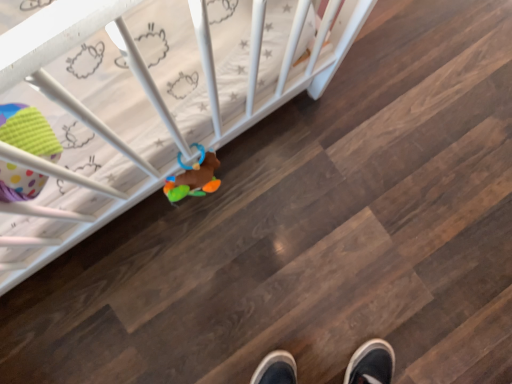
In order to face white plastic crib at upper left, should I rotate leftwards or rightwards?

Rotate your view right by about 3.658°.

What are the coordinates of `multicolored plush toy at center, the 1th toy when ordered from back to front` in the screenshot? It's located at (193, 177).

What are the coordinates of `polka dot fabric toy at left, which is counted as the first toy, starting from the front` in the screenshot? It's located at (28, 131).

Is point (36, 201) in front of point (8, 140)?

No.

Is white plastic crib at upper left facing towards polka dot fabric toy at left, which is counted as the first toy, starting from the front?

No, white plastic crib at upper left does not turn towards polka dot fabric toy at left, which is counted as the first toy, starting from the front.

Is white plastic crib at upper left directly adjacent to polka dot fabric toy at left, which is counted as the first toy, starting from the front?

No, white plastic crib at upper left is not making contact with polka dot fabric toy at left, which is counted as the first toy, starting from the front.

From their relative heights in the image, would you say polka dot fabric toy at left, marked as the first toy in a left-to-right arrangement, is taller or shorter than white plastic crib at upper left?

In the image, polka dot fabric toy at left, marked as the first toy in a left-to-right arrangement, appears to be taller than white plastic crib at upper left.

Where is `infant bed above the polka dot fabric toy at left, marked as the first toy in a left-to-right arrangement (from the image's perspective)`? The height and width of the screenshot is (384, 512). infant bed above the polka dot fabric toy at left, marked as the first toy in a left-to-right arrangement (from the image's perspective) is located at coordinates (145, 98).

Could you tell me if polka dot fabric toy at left, acting as the 2th toy starting from the back, is facing white plastic crib at upper left?

No, polka dot fabric toy at left, acting as the 2th toy starting from the back, is not oriented towards white plastic crib at upper left.

From a real-world perspective, which object stands above the other?

From a 3D spatial view, polka dot fabric toy at left, which ranks as the 2th toy in right-to-left order, is above.

Is multicolored plush toy at center, placed as the 1th toy when sorted from right to left, placed right next to polka dot fabric toy at left, which is counted as the first toy, starting from the front?

multicolored plush toy at center, placed as the 1th toy when sorted from right to left, is not next to polka dot fabric toy at left, which is counted as the first toy, starting from the front, and they're not touching.

In the scene shown: From a real-world perspective, which is physically above, multicolored plush toy at center, placed as the 1th toy when sorted from right to left, or polka dot fabric toy at left, marked as the first toy in a left-to-right arrangement?

polka dot fabric toy at left, marked as the first toy in a left-to-right arrangement.

Identify the location of toy located above the multicolored plush toy at center, which is the second toy in front-to-back order (from the image's perspective). (28, 131).

Do you think multicolored plush toy at center, the 1th toy when ordered from back to front, is within polka dot fabric toy at left, marked as the first toy in a left-to-right arrangement, or outside of it?

multicolored plush toy at center, the 1th toy when ordered from back to front, is spatially situated outside polka dot fabric toy at left, marked as the first toy in a left-to-right arrangement.

Consider the image. Which object is closer to the camera taking this photo, white plastic crib at upper left or multicolored plush toy at center, the 1th toy when ordered from back to front?

multicolored plush toy at center, the 1th toy when ordered from back to front, is more forward.

What's the angular difference between white plastic crib at upper left and multicolored plush toy at center, placed as the 1th toy when sorted from right to left,'s facing directions?

white plastic crib at upper left and multicolored plush toy at center, placed as the 1th toy when sorted from right to left, are facing 89.9 degrees away from each other.

Consider the image. Considering the sizes of objects white plastic crib at upper left and multicolored plush toy at center, placed as the 1th toy when sorted from right to left, in the image provided, who is smaller, white plastic crib at upper left or multicolored plush toy at center, placed as the 1th toy when sorted from right to left,?

multicolored plush toy at center, placed as the 1th toy when sorted from right to left.

Considering the sizes of objects polka dot fabric toy at left, acting as the 2th toy starting from the back, and multicolored plush toy at center, placed as the 1th toy when sorted from right to left, in the image provided, who is smaller, polka dot fabric toy at left, acting as the 2th toy starting from the back, or multicolored plush toy at center, placed as the 1th toy when sorted from right to left,?

With smaller size is multicolored plush toy at center, placed as the 1th toy when sorted from right to left.

How distant is polka dot fabric toy at left, acting as the 2th toy starting from the back, from multicolored plush toy at center, which is the second toy in front-to-back order?

The distance of polka dot fabric toy at left, acting as the 2th toy starting from the back, from multicolored plush toy at center, which is the second toy in front-to-back order, is 14.02 inches.

Is polka dot fabric toy at left, which is counted as the first toy, starting from the front, inside the boundaries of multicolored plush toy at center, which is the second toy in front-to-back order, or outside?

polka dot fabric toy at left, which is counted as the first toy, starting from the front, cannot be found inside multicolored plush toy at center, which is the second toy in front-to-back order.

Could you tell me if polka dot fabric toy at left, which ranks as the 2th toy in right-to-left order, is facing multicolored plush toy at center, placed as the second toy when sorted from left to right?

No.

From the image's perspective, is multicolored plush toy at center, placed as the 1th toy when sorted from right to left, above or below white plastic crib at upper left?

multicolored plush toy at center, placed as the 1th toy when sorted from right to left, is situated lower than white plastic crib at upper left in the image.

Is multicolored plush toy at center, placed as the second toy when sorted from left to right, outside of white plastic crib at upper left?

multicolored plush toy at center, placed as the second toy when sorted from left to right, lies outside white plastic crib at upper left's area.

Considering the relative positions of multicolored plush toy at center, placed as the second toy when sorted from left to right, and white plastic crib at upper left in the image provided, is multicolored plush toy at center, placed as the second toy when sorted from left to right, to the left of white plastic crib at upper left from the viewer's perspective?

Yes.

Between point (193, 167) and point (260, 74), which one is positioned in front?

Point (260, 74)

Image resolution: width=512 pixels, height=384 pixels. What are the coordinates of `infant bed below the polka dot fabric toy at left, which is counted as the first toy, starting from the front (from a real-world perspective)` in the screenshot? It's located at (145, 98).

Where is `infant bed above the polka dot fabric toy at left, marked as the first toy in a left-to-right arrangement (from the image's perspective)`? infant bed above the polka dot fabric toy at left, marked as the first toy in a left-to-right arrangement (from the image's perspective) is located at coordinates (145, 98).

Looking at the image, which one is located closer to multicolored plush toy at center, which is the second toy in front-to-back order, white plastic crib at upper left or polka dot fabric toy at left, acting as the 2th toy starting from the back?

The object closer to multicolored plush toy at center, which is the second toy in front-to-back order, is white plastic crib at upper left.

Looking at the image, which one is located further to white plastic crib at upper left, polka dot fabric toy at left, which is counted as the first toy, starting from the front, or multicolored plush toy at center, placed as the second toy when sorted from left to right?

polka dot fabric toy at left, which is counted as the first toy, starting from the front, is further to white plastic crib at upper left.

From the picture: Considering their positions, is white plastic crib at upper left positioned closer to polka dot fabric toy at left, marked as the first toy in a left-to-right arrangement, than multicolored plush toy at center, placed as the 1th toy when sorted from right to left?

white plastic crib at upper left.

Which object lies further to the anchor point polka dot fabric toy at left, acting as the 2th toy starting from the back, multicolored plush toy at center, placed as the 1th toy when sorted from right to left, or white plastic crib at upper left?

multicolored plush toy at center, placed as the 1th toy when sorted from right to left, is further to polka dot fabric toy at left, acting as the 2th toy starting from the back.

Which object lies nearer to the anchor point multicolored plush toy at center, which is the second toy in front-to-back order, polka dot fabric toy at left, acting as the 2th toy starting from the back, or white plastic crib at upper left?

white plastic crib at upper left lies closer to multicolored plush toy at center, which is the second toy in front-to-back order, than the other object.

Which object lies nearer to the anchor point white plastic crib at upper left, multicolored plush toy at center, the 1th toy when ordered from back to front, or polka dot fabric toy at left, marked as the first toy in a left-to-right arrangement?

multicolored plush toy at center, the 1th toy when ordered from back to front.

Locate an element on the screen. This screenshot has height=384, width=512. toy between polka dot fabric toy at left, which ranks as the 2th toy in right-to-left order, and white plastic crib at upper left in the front-back direction is located at coordinates (193, 177).